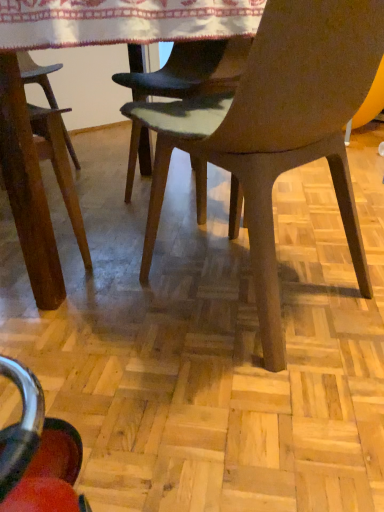
Question: From a real-world perspective, is white embroidered tablecloth at upper center under matte brown chair at center?

Choices:
 (A) yes
 (B) no

Answer: (B)

Question: Could you tell me if white embroidered tablecloth at upper center is turned towards matte brown chair at center?

Choices:
 (A) no
 (B) yes

Answer: (B)

Question: Does white embroidered tablecloth at upper center have a lesser height compared to matte brown chair at center?

Choices:
 (A) no
 (B) yes

Answer: (B)

Question: Considering the relative sizes of white embroidered tablecloth at upper center and matte brown chair at center in the image provided, is white embroidered tablecloth at upper center taller than matte brown chair at center?

Choices:
 (A) no
 (B) yes

Answer: (A)

Question: Is white embroidered tablecloth at upper center located outside matte brown chair at center?

Choices:
 (A) yes
 (B) no

Answer: (A)

Question: Does white embroidered tablecloth at upper center have a greater width compared to matte brown chair at center?

Choices:
 (A) yes
 (B) no

Answer: (A)

Question: From a real-world perspective, is matte brown chair at center positioned over white embroidered tablecloth at upper center based on gravity?

Choices:
 (A) no
 (B) yes

Answer: (A)

Question: Does matte brown chair at center have a greater height compared to white embroidered tablecloth at upper center?

Choices:
 (A) yes
 (B) no

Answer: (A)

Question: Does matte brown chair at center have a lesser height compared to white embroidered tablecloth at upper center?

Choices:
 (A) no
 (B) yes

Answer: (A)

Question: Can white embroidered tablecloth at upper center be found inside matte brown chair at center?

Choices:
 (A) no
 (B) yes

Answer: (A)

Question: Does matte brown chair at center have a smaller size compared to white embroidered tablecloth at upper center?

Choices:
 (A) yes
 (B) no

Answer: (B)

Question: Does matte brown chair at center have a greater width compared to white embroidered tablecloth at upper center?

Choices:
 (A) no
 (B) yes

Answer: (A)

Question: From a real-world perspective, is matte brown chair at center above or below white embroidered tablecloth at upper center?

Choices:
 (A) above
 (B) below

Answer: (B)